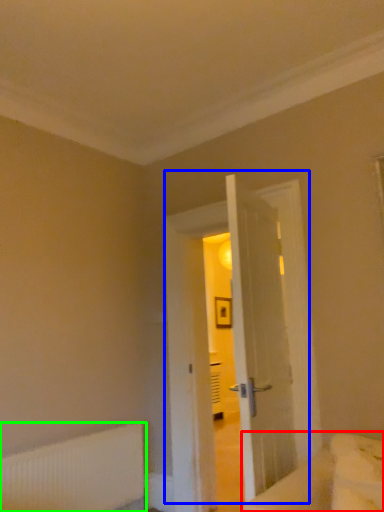
Question: Considering the real-world distances, which object is closest to bed (highlighted by a red box)? door (highlighted by a blue box) or radiator (highlighted by a green box).

Choices:
 (A) door
 (B) radiator

Answer: (A)